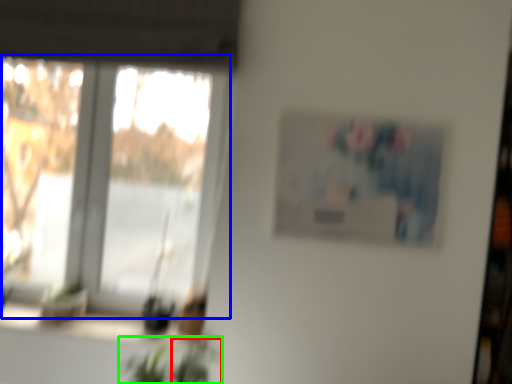
Question: Which object is the closest to the plant (highlighted by a red box)? Choose among these: window (highlighted by a blue box) or houseplant (highlighted by a green box).

Choices:
 (A) window
 (B) houseplant

Answer: (B)